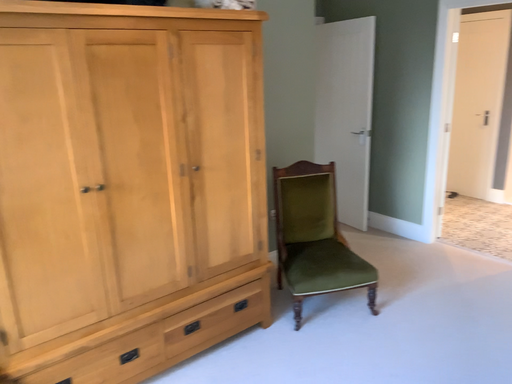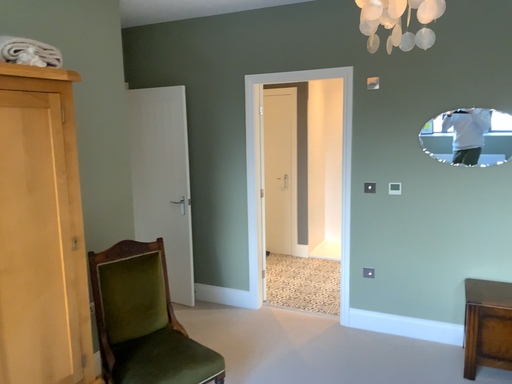
Question: How did the camera likely rotate when shooting the video?

Choices:
 (A) rotated right
 (B) rotated left

Answer: (A)